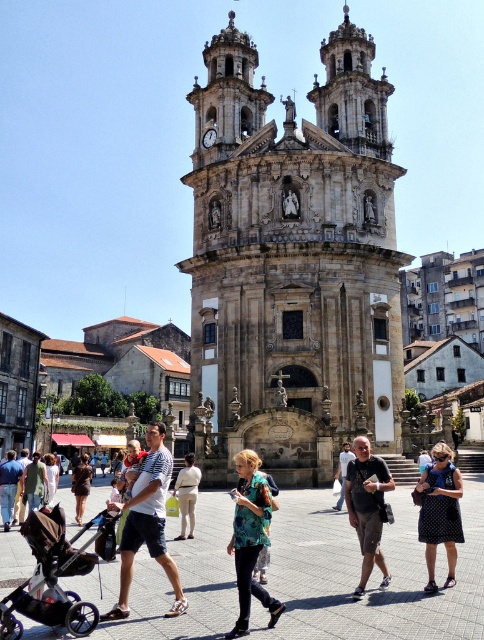
Can you confirm if striped cotton shirt at center is positioned to the right of polka dot dress at center?

In fact, striped cotton shirt at center is to the left of polka dot dress at center.

Is striped cotton shirt at center shorter than polka dot dress at center?

No, striped cotton shirt at center is not shorter than polka dot dress at center.

Which is behind, point (141, 529) or point (435, 470)?

The point (435, 470) is more distant.

Locate an element on the screen. The width and height of the screenshot is (484, 640). striped cotton shirt at center is located at coordinates (147, 522).

Can you confirm if beige cotton shirt at center is bigger than matte black shirt at center?

Yes.

Is beige cotton shirt at center thinner than matte black shirt at center?

Yes, beige cotton shirt at center is thinner than matte black shirt at center.

Who is more distant from viewer, (193, 461) or (334, 474)?

Point (334, 474)

I want to click on beige cotton shirt at center, so pyautogui.click(x=186, y=493).

Describe the element at coordinates (34, 483) in the screenshot. I see `green cotton shirt at center` at that location.

Who is lower down, green cotton shirt at center or brown leather jacket at center?

brown leather jacket at center is below.

The height and width of the screenshot is (640, 484). I want to click on green cotton shirt at center, so click(x=34, y=483).

Where is `green cotton shirt at center`? Image resolution: width=484 pixels, height=640 pixels. green cotton shirt at center is located at coordinates (34, 483).